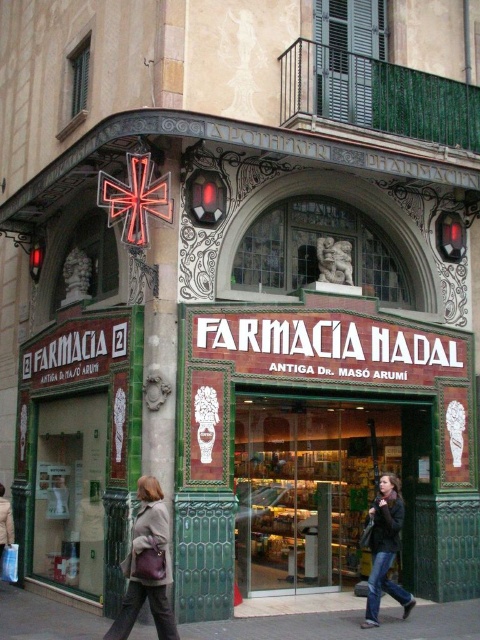
Question: Which of these objects is positioned closest to the concrete pavement at lower center?

Choices:
 (A) dark brown leather jacket at lower right
 (B) leather jacket at lower center

Answer: (B)

Question: Which is nearer to the leather jacket at lower center?

Choices:
 (A) concrete pavement at lower center
 (B) dark brown leather jacket at lower right

Answer: (A)

Question: Is concrete pavement at lower center to the right of dark brown leather jacket at lower right from the viewer's perspective?

Choices:
 (A) yes
 (B) no

Answer: (B)

Question: Does concrete pavement at lower center appear on the left side of leather jacket at lower center?

Choices:
 (A) yes
 (B) no

Answer: (B)

Question: Can you confirm if leather jacket at lower center is bigger than dark brown leather jacket at lower right?

Choices:
 (A) yes
 (B) no

Answer: (A)

Question: Considering the real-world distances, which object is farthest from the dark brown leather jacket at lower right?

Choices:
 (A) leather jacket at lower center
 (B) concrete pavement at lower center

Answer: (A)